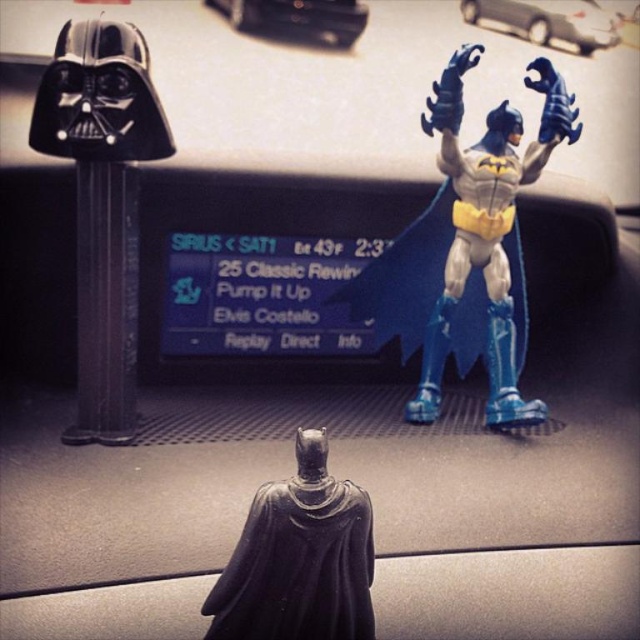
You are a toy collector who wants to place a new 12 inch tall Joker figure between the black matte darth vader head at left and the black glossy statue at center. Can the Joker fit in the space between them without overlapping?

The distance between the black matte darth vader head at left and the black glossy statue at center is 21.07 inches. Since the Joker figure is only 12 inches tall, there is sufficient space for it to fit between them without overlapping.

You are a toy collector trying to fit a new toy into your car dashboard display. The new toy is 10 cm tall. You see the blue plastic batman figure at upper right and the black matte darth vader head at left. Can you place the new toy between them without moving the existing figures?

The blue plastic batman figure at upper right is positioned over the black matte darth vader head at left. Since the blue plastic batman figure is above the black matte darth vader head, there is no horizontal space between them to place the new toy. The new toy cannot be placed between them without moving the existing figures.

You are a collector who wants to display the black matte darth vader head at left and the black glossy statue at center on a shelf. Which object should you place first to ensure they fit properly?

The black matte darth vader head at left is larger in size than the black glossy statue at center, so you should place the black matte darth vader head at left first to ensure they fit properly on the shelf.